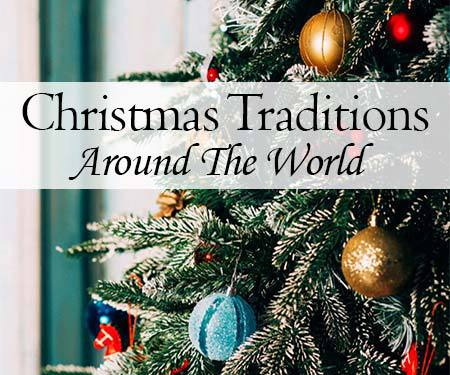
Where is `decorative pine leaves`? The width and height of the screenshot is (450, 375). decorative pine leaves is located at coordinates (305, 281), (261, 337), (297, 224), (115, 223), (108, 245), (133, 300), (263, 15).